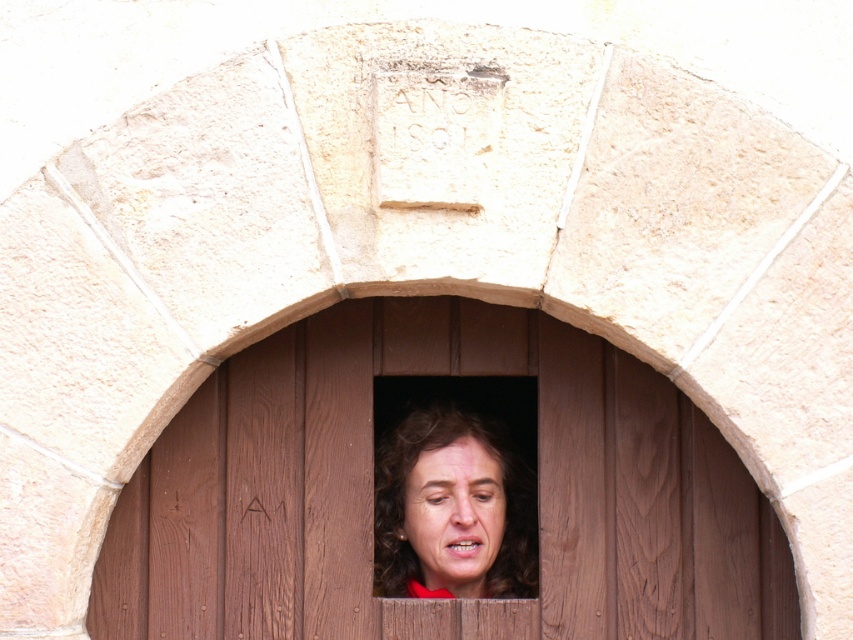
You are an artist sketching the scene and want to ensure proportions are accurate. Which object should you draw first to establish the correct scale between curly brown hair at center and smooth skin face at center?

You should draw the curly brown hair at center first because it has a larger size compared to the smooth skin face at center, so starting with the larger object helps establish the correct scale.

You are standing at the camera position and want to take a photo of the brown wooden window at center. If your camera has a maximum focus range of 15 feet, will it be able to focus on the window?

The brown wooden window at center and camera are 14.46 feet apart, so yes, the camera can focus on the window since the distance is within the 15 feet maximum range.